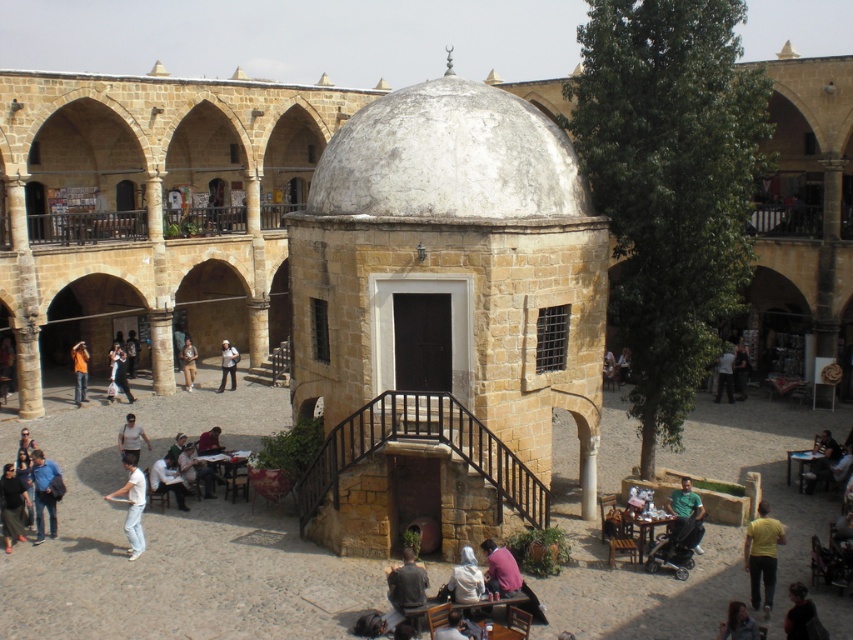
You are a tour guide leading a group in the courtyard. You notice two visitors wearing a dark green shirt at lower right and a white cotton shirt at lower left. If you want to gather all your group members between these two visitors, will the space between them be sufficient to accommodate 20 people standing shoulder to shoulder? Assume each person occupies 2 feet of space.

The distance between the dark green shirt at lower right and the white cotton shirt at lower left is 189.33 feet. Since 20 people require 40 feet of space, the available space is more than enough to accommodate them.